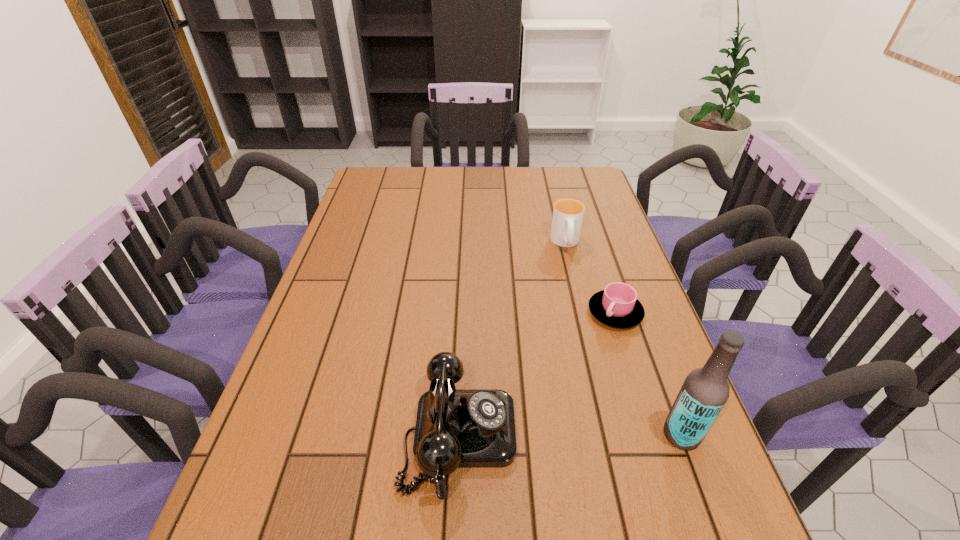
Locate an element on the screen. The width and height of the screenshot is (960, 540). free region at the left edge of the desktop is located at coordinates (353, 321).

Locate an element on the screen. The height and width of the screenshot is (540, 960). blank space at the right edge of the desktop is located at coordinates (644, 287).

This screenshot has width=960, height=540. Find the location of `vacant space at the far left corner of the desktop`. vacant space at the far left corner of the desktop is located at coordinates (358, 193).

Where is `free space between the shortest object and the beer bottle`? free space between the shortest object and the beer bottle is located at coordinates click(648, 373).

Find the location of a particular element. free point between the telephone and the tallest object is located at coordinates (570, 435).

Locate an element on the screen. Image resolution: width=960 pixels, height=540 pixels. empty location between the farther cup and the beer bottle is located at coordinates (624, 339).

Identify the location of vacant point located between the farther cup and the beer bottle. The width and height of the screenshot is (960, 540). (624, 339).

Find the location of a particular element. The height and width of the screenshot is (540, 960). empty space that is in between the leftmost object and the farther cup is located at coordinates (513, 339).

This screenshot has width=960, height=540. I want to click on free spot between the shortest object and the beer bottle, so click(x=648, y=373).

Where is `free space between the tallest object and the taller cup`? free space between the tallest object and the taller cup is located at coordinates click(624, 339).